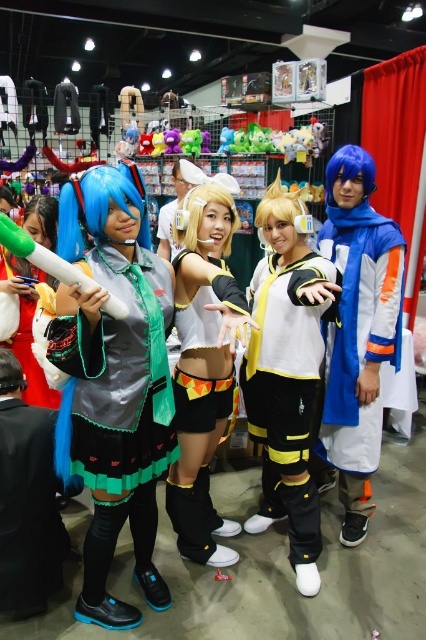
Question: Among these points, which one is nearest to the camera?

Choices:
 (A) (192, 401)
 (B) (86, 477)
 (C) (348, 417)
 (D) (264, 266)

Answer: (B)

Question: Which is farther from the shiny silver dress at center?

Choices:
 (A) shiny silver jacket at center
 (B) plush purple bear at center
 (C) white matte uniform at center

Answer: (B)

Question: Does shiny silver jacket at center appear on the left side of plush purple bear at center?

Choices:
 (A) no
 (B) yes

Answer: (A)

Question: Which point is farther from the camera taking this photo?

Choices:
 (A) (233, 387)
 (B) (336, 460)
 (C) (187, 240)
 (D) (77, 392)

Answer: (B)

Question: Is the position of white matte shorts at center less distant than that of white satin skirt at center?

Choices:
 (A) yes
 (B) no

Answer: (A)

Question: Is white satin skirt at center wider than plush purple bear at center?

Choices:
 (A) no
 (B) yes

Answer: (B)